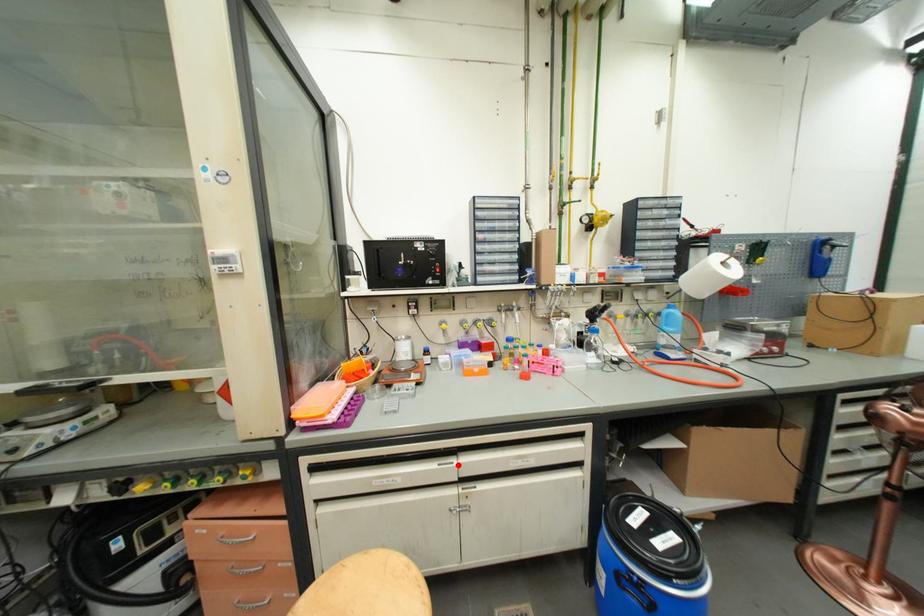
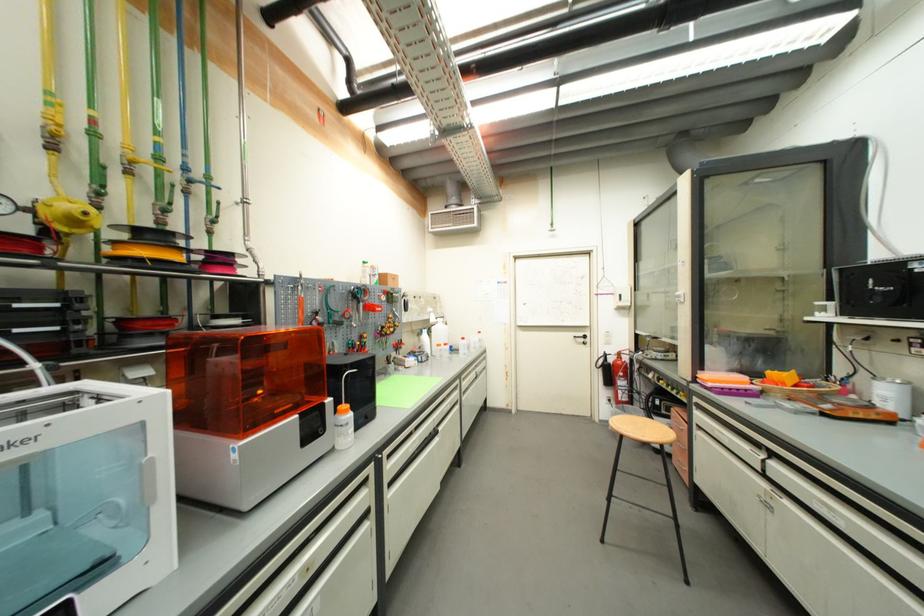
Locate, in the second image, the point that corresponds to the highlighted location in the first image.

(764, 456)